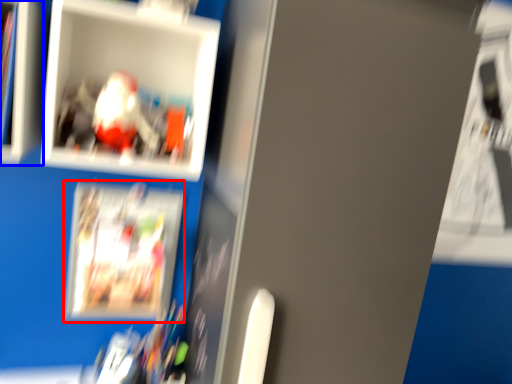
Question: Which object is further to the camera taking this photo, magazine (highlighted by a red box) or cabinet (highlighted by a blue box)?

Choices:
 (A) magazine
 (B) cabinet

Answer: (A)